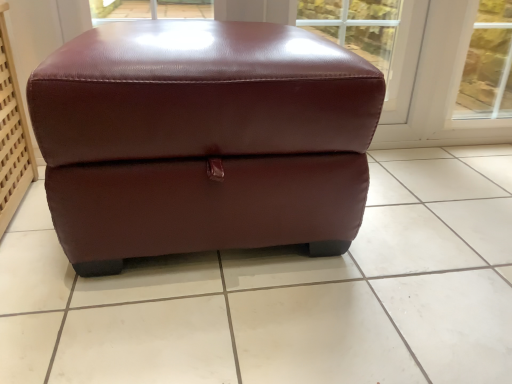
Question: Is burgundy leather ottoman at center to the left of burgundy leather ottoman at center from the viewer's perspective?

Choices:
 (A) yes
 (B) no

Answer: (A)

Question: Does burgundy leather ottoman at center have a greater width compared to burgundy leather ottoman at center?

Choices:
 (A) yes
 (B) no

Answer: (B)

Question: Does burgundy leather ottoman at center lie in front of burgundy leather ottoman at center?

Choices:
 (A) yes
 (B) no

Answer: (B)

Question: Is burgundy leather ottoman at center smaller than burgundy leather ottoman at center?

Choices:
 (A) yes
 (B) no

Answer: (B)

Question: Is burgundy leather ottoman at center shorter than burgundy leather ottoman at center?

Choices:
 (A) yes
 (B) no

Answer: (B)

Question: Is burgundy leather ottoman at center looking in the opposite direction of burgundy leather ottoman at center?

Choices:
 (A) yes
 (B) no

Answer: (B)

Question: From the image's perspective, is burgundy leather ottoman at center located beneath burgundy leather ottoman at center?

Choices:
 (A) yes
 (B) no

Answer: (A)

Question: Is burgundy leather ottoman at center shorter than burgundy leather ottoman at center?

Choices:
 (A) no
 (B) yes

Answer: (B)

Question: Does burgundy leather ottoman at center have a greater height compared to burgundy leather ottoman at center?

Choices:
 (A) yes
 (B) no

Answer: (B)

Question: Is burgundy leather ottoman at center turned away from burgundy leather ottoman at center?

Choices:
 (A) yes
 (B) no

Answer: (B)

Question: Can you confirm if burgundy leather ottoman at center is smaller than burgundy leather ottoman at center?

Choices:
 (A) yes
 (B) no

Answer: (A)

Question: Is burgundy leather ottoman at center facing towards burgundy leather ottoman at center?

Choices:
 (A) yes
 (B) no

Answer: (B)

Question: From the image's perspective, is burgundy leather ottoman at center located above or below burgundy leather ottoman at center?

Choices:
 (A) below
 (B) above

Answer: (A)